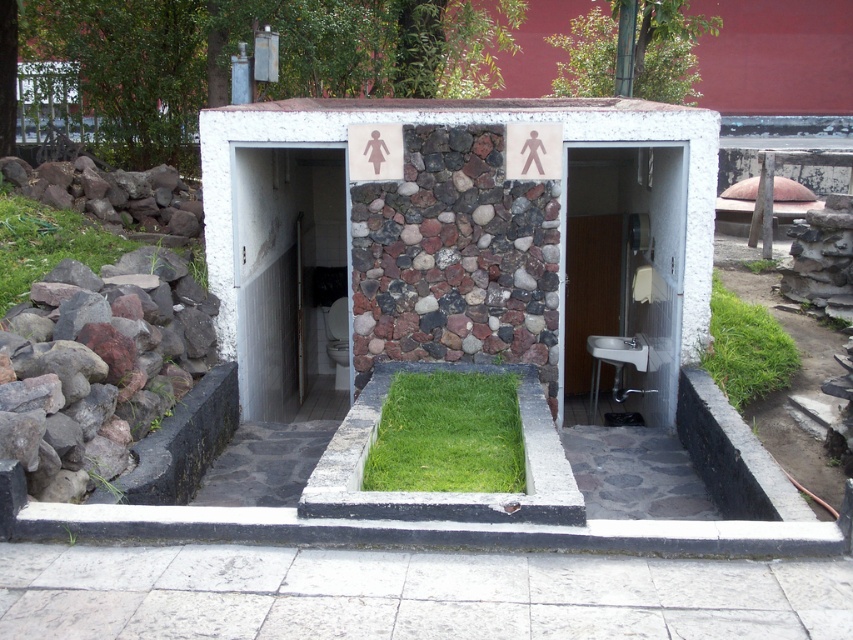
You are standing in front of the public restroom and need to enter the stall with a toilet. The entrance has a white glossy door at center and gray rough rocks at left. Which object should you approach to enter the correct stall?

The white glossy door at center leads to the stall with the toilet, so you should approach the white glossy door at center to enter the correct stall.

You are standing in front of the public restroom and want to reach the point marked at coordinate (416,472). If your walking distance is limited to 4 meters, can you reach it without moving further away?

The point at coordinate (416,472) is 4.72 meters away from the viewer, which exceeds your 4 meter limit. You cannot reach it within the allowed distance.

You are standing in front of the public restroom and want to take a photo of the point at coordinates point (479,196). If your camera has a maximum focus range of 20 feet, will you need to move closer to focus on it?

The point (479,196) is 21.43 feet away from the camera, which exceeds the maximum focus range of 20 feet. Therefore, you need to move closer to focus on it.